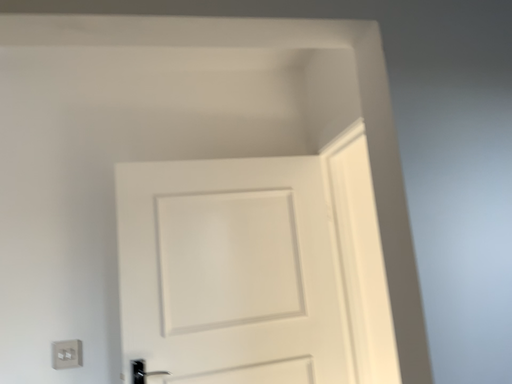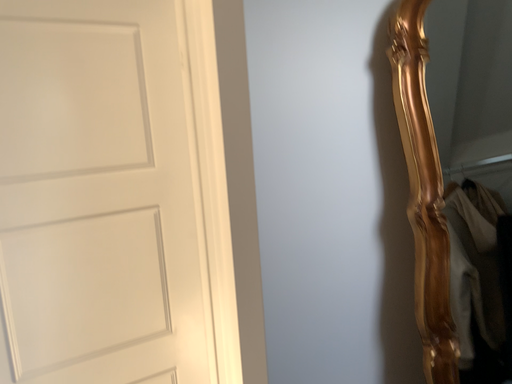
Question: How did the camera likely rotate when shooting the video?

Choices:
 (A) rotated upward
 (B) rotated downward

Answer: (B)